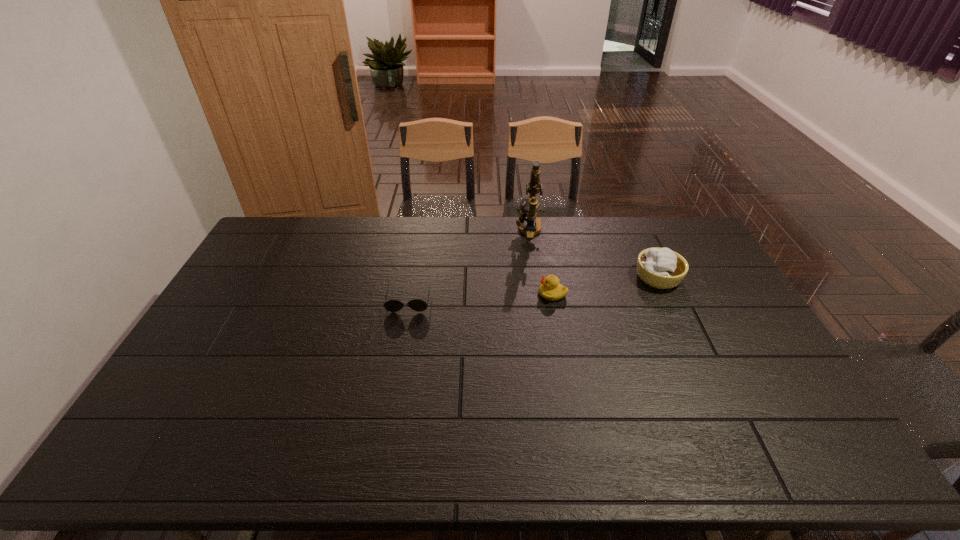
Where is `vacant space located 0.140m on the front-facing side of the duckling`? This screenshot has height=540, width=960. vacant space located 0.140m on the front-facing side of the duckling is located at coordinates (495, 294).

Identify the location of free space located 0.390m on the front-facing side of the duckling. The width and height of the screenshot is (960, 540). pyautogui.click(x=420, y=294).

The height and width of the screenshot is (540, 960). In order to click on blank space located 0.180m on the front-facing side of the leftmost object in this screenshot , I will do `click(398, 358)`.

Find the location of `object that is at the far edge`. object that is at the far edge is located at coordinates (531, 205).

Where is `object positioned at the right edge`? object positioned at the right edge is located at coordinates (662, 268).

The image size is (960, 540). In the image, there is a desktop. What are the coordinates of `free space at the far edge` in the screenshot? It's located at (379, 236).

Find the location of a particular element. The width and height of the screenshot is (960, 540). vacant area at the near edge of the desktop is located at coordinates (475, 441).

This screenshot has height=540, width=960. In order to click on vacant space at the left edge of the desktop in this screenshot , I will do `click(267, 289)`.

Find the location of a particular element. vacant space at the right edge is located at coordinates (735, 374).

In the image, there is a desktop. Identify the location of free space at the far left corner. The image size is (960, 540). (262, 234).